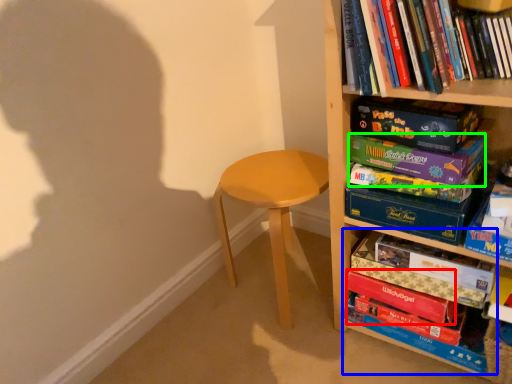
Question: Which is farther away from paperback book (highlighted by a red box)? book (highlighted by a blue box) or paperback book (highlighted by a green box)?

Choices:
 (A) book
 (B) paperback book

Answer: (B)